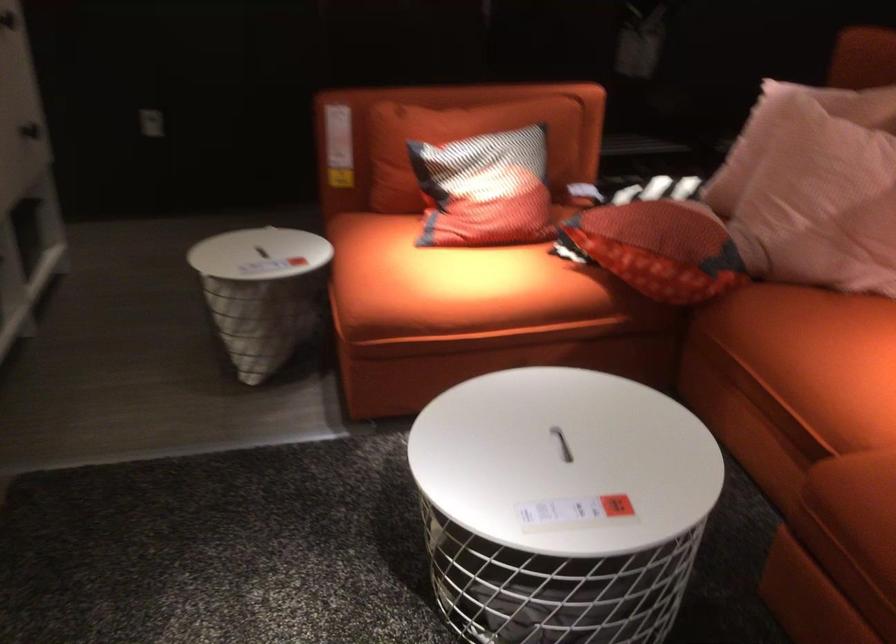
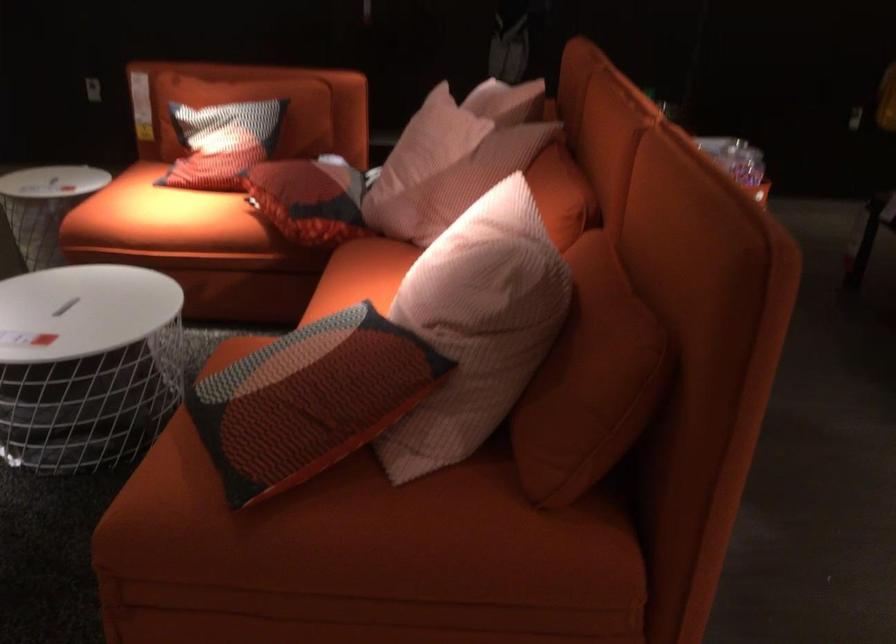
The point at (495, 181) is marked in the first image. Where is the corresponding point in the second image?

(222, 142)